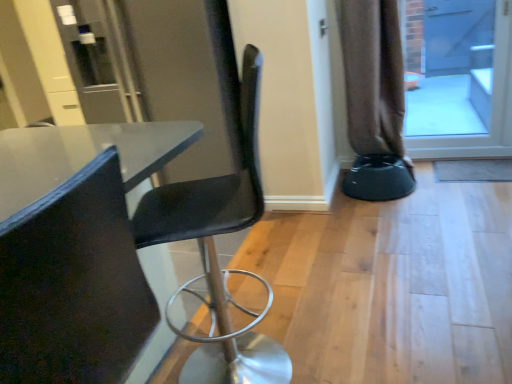
The image size is (512, 384). In order to click on vacant location below matte black chair at center, arranged as the first chair when viewed from the back (from a real-world perspective) in this screenshot , I will do `click(230, 356)`.